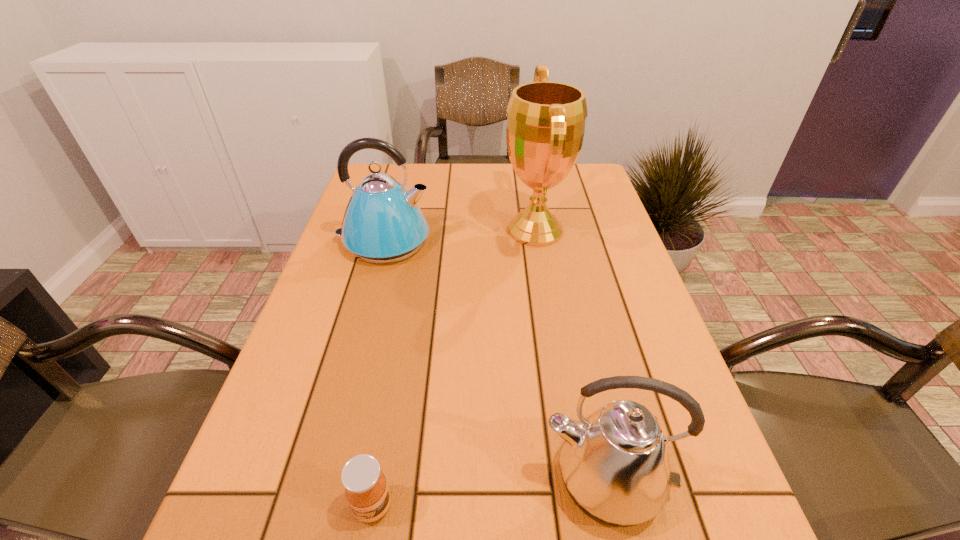
Image resolution: width=960 pixels, height=540 pixels. What are the coordinates of `free spot between the honey and the tallest object` in the screenshot? It's located at (454, 368).

Image resolution: width=960 pixels, height=540 pixels. Find the location of `vacant point located between the honey and the tallest object`. vacant point located between the honey and the tallest object is located at coordinates (454, 368).

At what (x,y) coordinates should I click in order to perform the action: click on free space between the tallest object and the shortest object. Please return your answer as a coordinate pair (x, y). Image resolution: width=960 pixels, height=540 pixels. Looking at the image, I should click on (454, 368).

At what (x,y) coordinates should I click in order to perform the action: click on blank region between the nearer kettle and the left kettle. Please return your answer as a coordinate pair (x, y). Looking at the image, I should click on (494, 361).

Where is `vacant point located between the right kettle and the tallest object`? vacant point located between the right kettle and the tallest object is located at coordinates [570, 355].

The height and width of the screenshot is (540, 960). Identify the location of free space between the tallest object and the nearer kettle. (570, 355).

Locate an element on the screen. The width and height of the screenshot is (960, 540). free space between the award and the left kettle is located at coordinates (460, 236).

This screenshot has height=540, width=960. I want to click on the third closest object relative to the farther kettle, so click(366, 489).

This screenshot has width=960, height=540. Identify the location of the third closest object to the shortest object. (545, 128).

Where is `free space that satisfies the following two spatial constraints: 1. on the front-facing side of the tallest object; 2. on the front-facing side of the honey`? The height and width of the screenshot is (540, 960). free space that satisfies the following two spatial constraints: 1. on the front-facing side of the tallest object; 2. on the front-facing side of the honey is located at coordinates (581, 506).